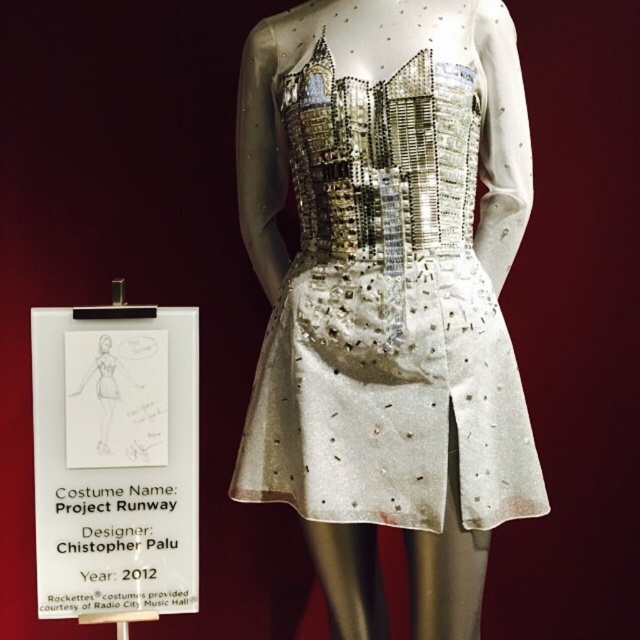
Who is shorter, satin-like silver dress at center or white paper at center?

Standing shorter between the two is white paper at center.

Can you confirm if satin-like silver dress at center is thinner than white paper at center?

No, satin-like silver dress at center is not thinner than white paper at center.

Image resolution: width=640 pixels, height=640 pixels. In order to click on satin-like silver dress at center in this screenshot , I will do `click(387, 268)`.